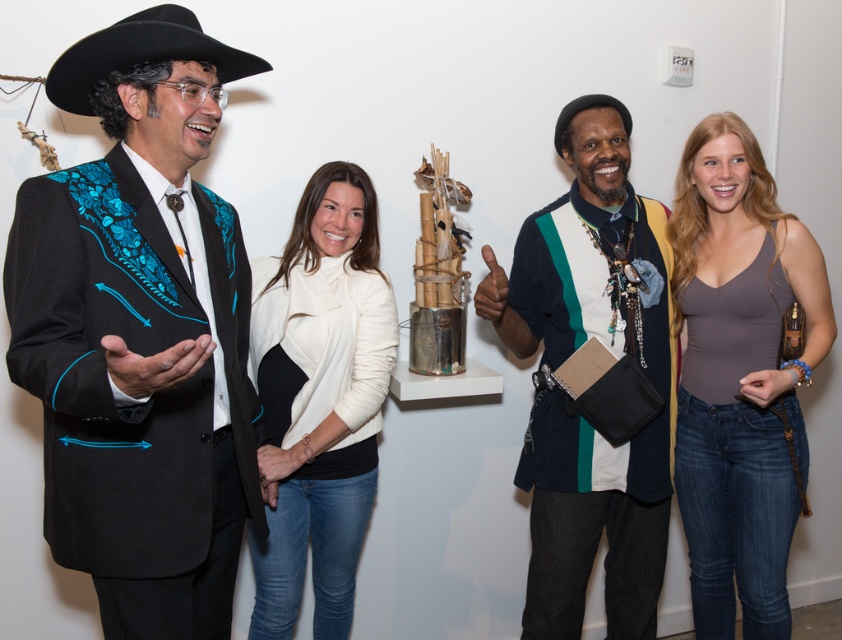
Question: Based on their relative distances, which object is nearer to the matte black suit at left?

Choices:
 (A) black felt cowboy hat at upper left
 (B) matte gray tank top at right
 (C) white matte jacket at center
 (D) multicolored knitted sweater at center

Answer: (A)

Question: Is matte black suit at left wider than multicolored knitted sweater at center?

Choices:
 (A) no
 (B) yes

Answer: (A)

Question: Observing the image, what is the correct spatial positioning of multicolored knitted sweater at center in reference to white matte jacket at center?

Choices:
 (A) below
 (B) above

Answer: (B)

Question: Is matte black suit at left above multicolored knitted sweater at center?

Choices:
 (A) no
 (B) yes

Answer: (B)

Question: Which point is closer to the camera?

Choices:
 (A) matte gray tank top at right
 (B) multicolored knitted sweater at center
 (C) matte black suit at left

Answer: (C)

Question: Which object is positioned farthest from the black felt cowboy hat at upper left?

Choices:
 (A) matte gray tank top at right
 (B) white matte jacket at center
 (C) multicolored knitted sweater at center

Answer: (A)